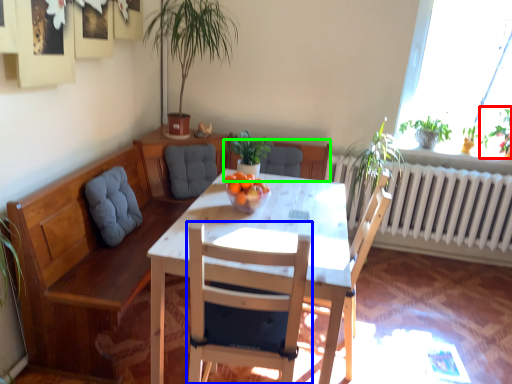
Question: Estimate the real-world distances between objects in this image. Which object is farther from plant (highlighted by a red box), chair (highlighted by a blue box) or chair (highlighted by a green box)?

Choices:
 (A) chair
 (B) chair

Answer: (A)